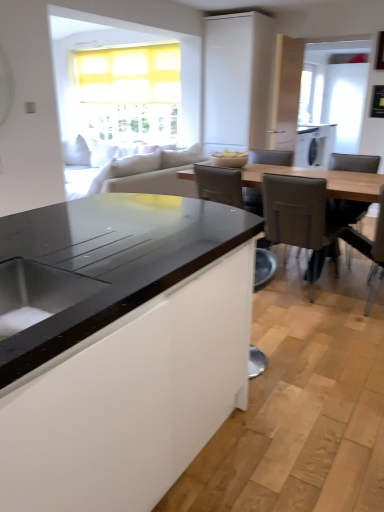
Question: Is metallic gray chair at lower center, positioned as the 1th chair in left-to-right order, at the right side of leatherette chair at right, which ranks as the 3th chair in right-to-left order?

Choices:
 (A) yes
 (B) no

Answer: (B)

Question: Can you confirm if metallic gray chair at lower center, which is the 4th chair in right-to-left order, is taller than leatherette chair at right, which ranks as the 3th chair in right-to-left order?

Choices:
 (A) yes
 (B) no

Answer: (B)

Question: From a real-world perspective, is metallic gray chair at lower center, positioned as the 1th chair in left-to-right order, below leatherette chair at right, acting as the second chair starting from the left?

Choices:
 (A) no
 (B) yes

Answer: (B)

Question: Is metallic gray chair at lower center, which is the 4th chair in right-to-left order, turned away from leatherette chair at right, acting as the second chair starting from the left?

Choices:
 (A) no
 (B) yes

Answer: (A)

Question: Considering the relative sizes of metallic gray chair at lower center, which is the 4th chair in right-to-left order, and leatherette chair at right, acting as the second chair starting from the left, in the image provided, is metallic gray chair at lower center, which is the 4th chair in right-to-left order, bigger than leatherette chair at right, acting as the second chair starting from the left,?

Choices:
 (A) no
 (B) yes

Answer: (A)

Question: Does metallic gray chair at lower center, positioned as the 1th chair in left-to-right order, have a lesser width compared to leatherette chair at right, which ranks as the 3th chair in right-to-left order?

Choices:
 (A) yes
 (B) no

Answer: (A)

Question: From a real-world perspective, is matte white bowl at center located beneath leather-like gray armchair at center?

Choices:
 (A) no
 (B) yes

Answer: (A)

Question: From the image's perspective, does matte white bowl at center appear lower than leather-like gray armchair at center?

Choices:
 (A) no
 (B) yes

Answer: (A)

Question: Are matte white bowl at center and leather-like gray armchair at center located far from each other?

Choices:
 (A) no
 (B) yes

Answer: (A)

Question: Is matte white bowl at center looking in the opposite direction of leather-like gray armchair at center?

Choices:
 (A) no
 (B) yes

Answer: (A)

Question: Does matte white bowl at center have a greater height compared to leather-like gray armchair at center?

Choices:
 (A) yes
 (B) no

Answer: (B)

Question: Can you confirm if matte white bowl at center is shorter than leather-like gray armchair at center?

Choices:
 (A) yes
 (B) no

Answer: (A)

Question: Is white matte cabinet at upper center smaller than brown leather chair at right, which is the third chair from left to right?

Choices:
 (A) yes
 (B) no

Answer: (B)